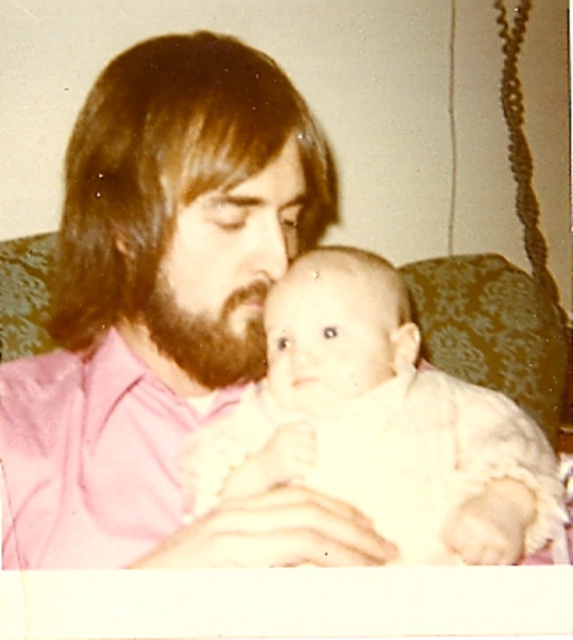
Question: Is white fluffy baby at center positioned behind dark brown fuzzy beard at center?

Choices:
 (A) yes
 (B) no

Answer: (B)

Question: Is the position of white fluffy baby at center less distant than that of dark brown fuzzy beard at center?

Choices:
 (A) yes
 (B) no

Answer: (A)

Question: Which object appears closest to the camera in this image?

Choices:
 (A) white fluffy baby at center
 (B) dark brown fuzzy beard at center

Answer: (A)

Question: Considering the relative positions of white fluffy baby at center and dark brown fuzzy beard at center in the image provided, where is white fluffy baby at center located with respect to dark brown fuzzy beard at center?

Choices:
 (A) left
 (B) right

Answer: (B)